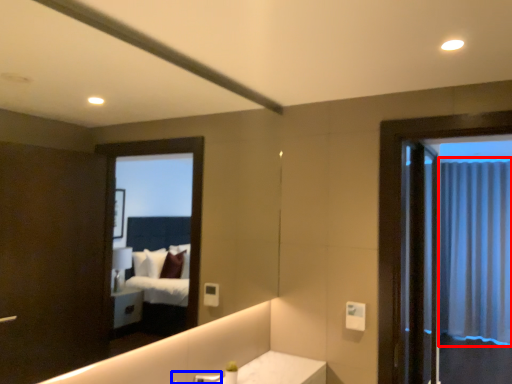
Question: Which object is further to the camera taking this photo, curtain (highlighted by a red box) or faucet (highlighted by a blue box)?

Choices:
 (A) curtain
 (B) faucet

Answer: (A)